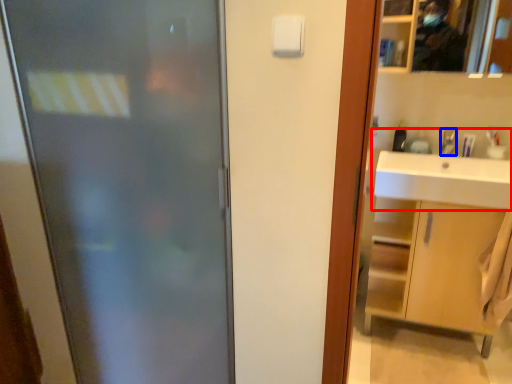
Question: Which of the following is the farthest to the observer, sink (highlighted by a red box) or faucet (highlighted by a blue box)?

Choices:
 (A) sink
 (B) faucet

Answer: (B)